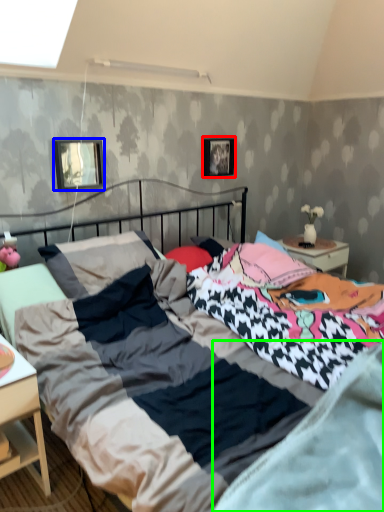
Question: Estimate the real-world distances between objects in this image. Which object is farther from picture frame (highlighted by a red box), picture frame (highlighted by a blue box) or mattress (highlighted by a green box)?

Choices:
 (A) picture frame
 (B) mattress

Answer: (B)